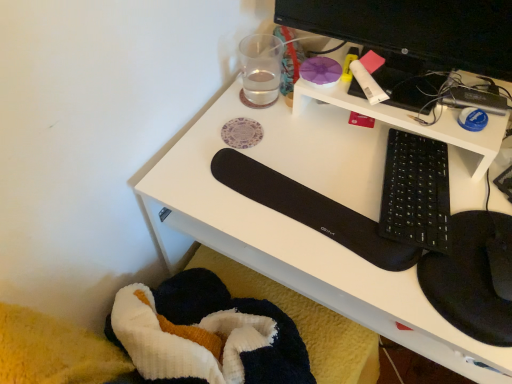
Question: Considering the relative sizes of white matte glue stick at upper right, positioned as the 1th stationery in front-to-back order, and black matte keyboard at center-right in the image provided, is white matte glue stick at upper right, positioned as the 1th stationery in front-to-back order, wider than black matte keyboard at center-right?

Choices:
 (A) no
 (B) yes

Answer: (A)

Question: Is white matte glue stick at upper right, positioned as the 1th stationery in front-to-back order, shorter than black matte keyboard at center-right?

Choices:
 (A) no
 (B) yes

Answer: (B)

Question: Is white matte glue stick at upper right, positioned as the first stationery in right-to-left order, facing away from black matte keyboard at center-right?

Choices:
 (A) yes
 (B) no

Answer: (B)

Question: Does white matte glue stick at upper right, arranged as the second stationery when viewed from the left, touch black matte keyboard at center-right?

Choices:
 (A) yes
 (B) no

Answer: (B)

Question: From the image's perspective, does white matte glue stick at upper right, which is the 2th stationery from back to front, appear lower than black matte keyboard at center-right?

Choices:
 (A) yes
 (B) no

Answer: (B)

Question: Can you confirm if white matte glue stick at upper right, arranged as the second stationery when viewed from the left, is bigger than black matte keyboard at center-right?

Choices:
 (A) no
 (B) yes

Answer: (A)

Question: Is black matte keyboard at center-right at the left side of white matte glue stick at upper right, positioned as the first stationery in right-to-left order?

Choices:
 (A) no
 (B) yes

Answer: (A)

Question: From the image's perspective, is black matte keyboard at center-right under white matte glue stick at upper right, positioned as the 1th stationery in front-to-back order?

Choices:
 (A) no
 (B) yes

Answer: (B)

Question: Considering the relative sizes of black matte keyboard at center-right and white matte glue stick at upper right, positioned as the first stationery in right-to-left order, in the image provided, is black matte keyboard at center-right wider than white matte glue stick at upper right, positioned as the first stationery in right-to-left order,?

Choices:
 (A) no
 (B) yes

Answer: (B)

Question: Is the position of black matte keyboard at center-right more distant than that of white matte glue stick at upper right, positioned as the 1th stationery in front-to-back order?

Choices:
 (A) yes
 (B) no

Answer: (B)

Question: Can you confirm if black matte keyboard at center-right is taller than white matte glue stick at upper right, positioned as the 1th stationery in front-to-back order?

Choices:
 (A) yes
 (B) no

Answer: (A)

Question: From the image's perspective, would you say black matte keyboard at center-right is positioned over white matte glue stick at upper right, positioned as the 1th stationery in front-to-back order?

Choices:
 (A) no
 (B) yes

Answer: (A)

Question: Is white matte glue stick at upper right, arranged as the second stationery when viewed from the left, positioned with its back to transparent glass at upper center, the first stationery positioned from the left?

Choices:
 (A) no
 (B) yes

Answer: (A)